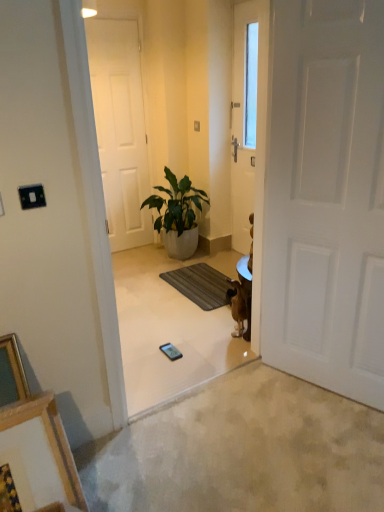
Question: Is wooden picture frame at lower left positioned in front of black glossy mobile phone at center?

Choices:
 (A) no
 (B) yes

Answer: (B)

Question: Is wooden picture frame at lower left taller than black glossy mobile phone at center?

Choices:
 (A) yes
 (B) no

Answer: (A)

Question: Are wooden picture frame at lower left and black glossy mobile phone at center far apart?

Choices:
 (A) no
 (B) yes

Answer: (B)

Question: Is wooden picture frame at lower left oriented towards black glossy mobile phone at center?

Choices:
 (A) yes
 (B) no

Answer: (B)

Question: Considering the relative positions of wooden picture frame at lower left and black glossy mobile phone at center in the image provided, is wooden picture frame at lower left to the left of black glossy mobile phone at center from the viewer's perspective?

Choices:
 (A) yes
 (B) no

Answer: (A)

Question: Can you confirm if wooden picture frame at lower left is wider than black glossy mobile phone at center?

Choices:
 (A) yes
 (B) no

Answer: (B)

Question: From a real-world perspective, is white matte door at center, which is the second door from right to left, positioned over black glossy mobile phone at center based on gravity?

Choices:
 (A) yes
 (B) no

Answer: (A)

Question: Is white matte door at center, which is the second door from right to left, shorter than black glossy mobile phone at center?

Choices:
 (A) no
 (B) yes

Answer: (A)

Question: Is white matte door at center, which is the second door from right to left, smaller than black glossy mobile phone at center?

Choices:
 (A) no
 (B) yes

Answer: (A)

Question: From the image's perspective, would you say white matte door at center, which is the second door from right to left, is shown under black glossy mobile phone at center?

Choices:
 (A) yes
 (B) no

Answer: (B)

Question: Is white matte door at center, which is the second door from right to left, not inside black glossy mobile phone at center?

Choices:
 (A) yes
 (B) no

Answer: (A)

Question: Could you tell me if white matte door at center, positioned as the second door in front-to-back order, is facing black glossy mobile phone at center?

Choices:
 (A) no
 (B) yes

Answer: (B)

Question: Considering the relative sizes of green leafy plant in white pot at center and white matte door at center, which is counted as the 1th door, starting from the back, in the image provided, is green leafy plant in white pot at center wider than white matte door at center, which is counted as the 1th door, starting from the back,?

Choices:
 (A) no
 (B) yes

Answer: (B)